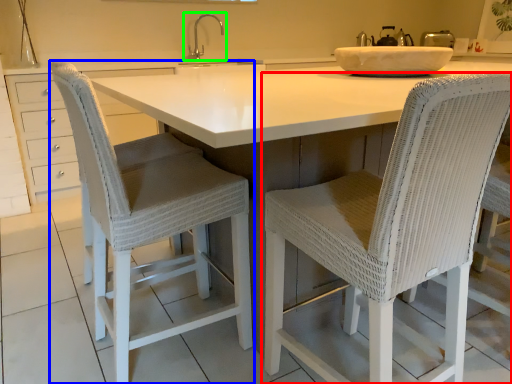
Question: Which object is the closest to the chair (highlighted by a red box)? Choose among these: chair (highlighted by a blue box) or tap (highlighted by a green box).

Choices:
 (A) chair
 (B) tap

Answer: (A)